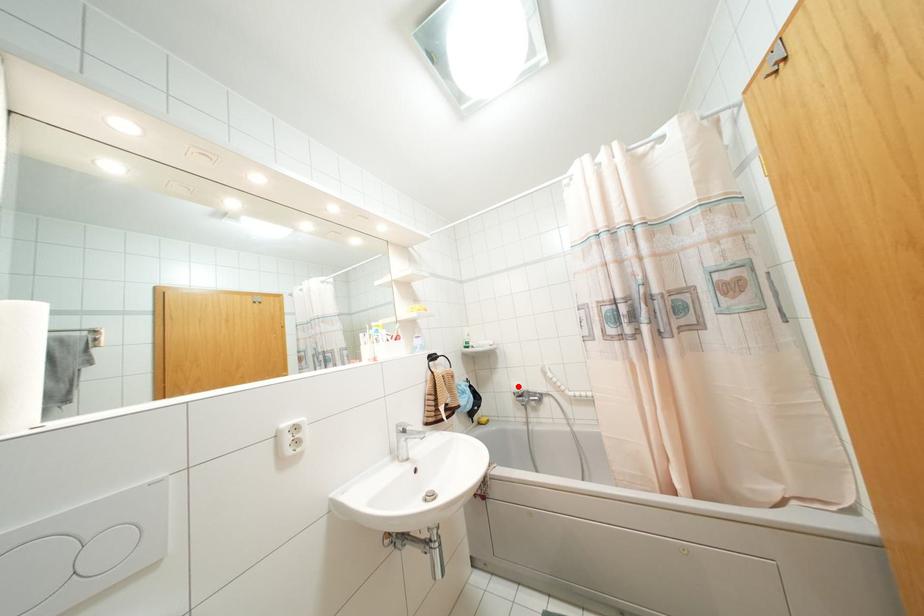
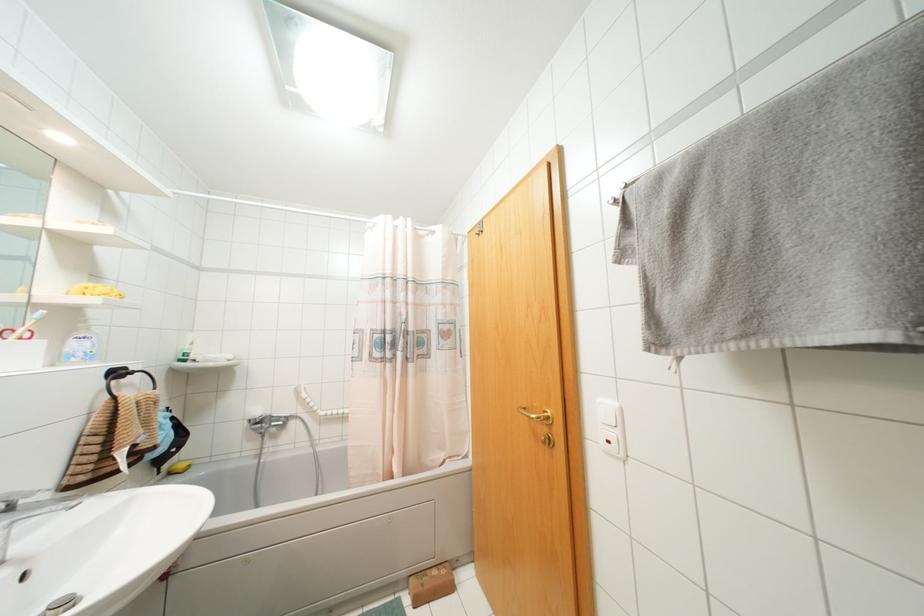
In the second image, find the point that corresponds to the highlighted location in the first image.

(258, 411)